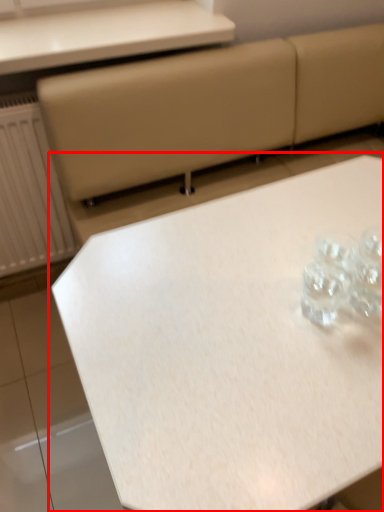
Question: Observing the image, what is the correct spatial positioning of table (annotated by the red box) in reference to table?

Choices:
 (A) right
 (B) left

Answer: (A)